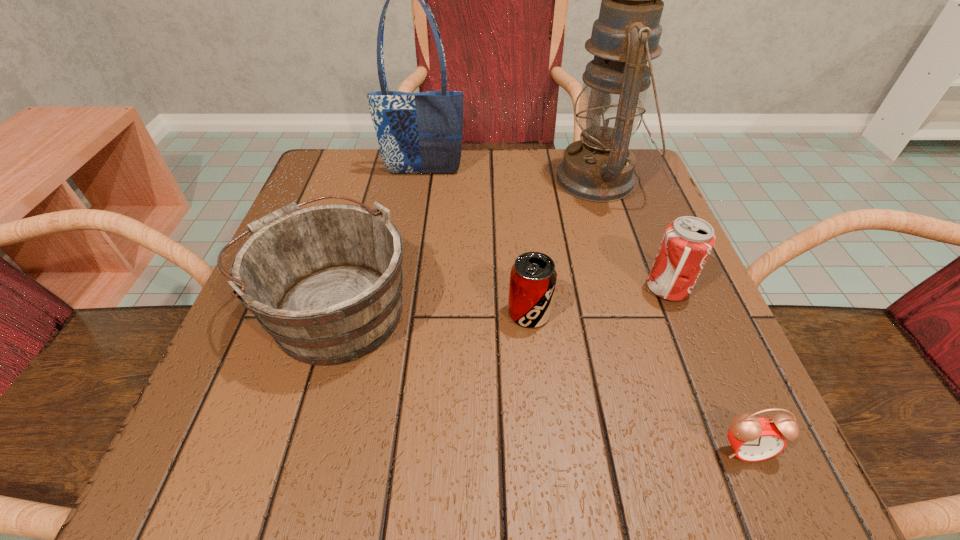
I want to click on oil lamp, so click(x=600, y=168).

Where is `shopping bag`? shopping bag is located at coordinates (418, 133).

Where is `wine bucket`? The height and width of the screenshot is (540, 960). wine bucket is located at coordinates (325, 281).

At what (x,y) coordinates should I click in order to perform the action: click on the taller soda can. Please return your answer as a coordinate pair (x, y). Looking at the image, I should click on (688, 241).

Find the location of a particular element. the third object from left to right is located at coordinates (533, 276).

Locate an element on the screen. The height and width of the screenshot is (540, 960). the second shortest object is located at coordinates (533, 276).

Identify the location of alarm clock. (752, 439).

Locate an element on the screen. the shortest object is located at coordinates (752, 439).

Locate an element on the screen. The image size is (960, 540). vacant space located 0.280m on the left of the oil lamp is located at coordinates (429, 179).

Identify the location of free space located on the front-facing side of the shopping bag. (405, 288).